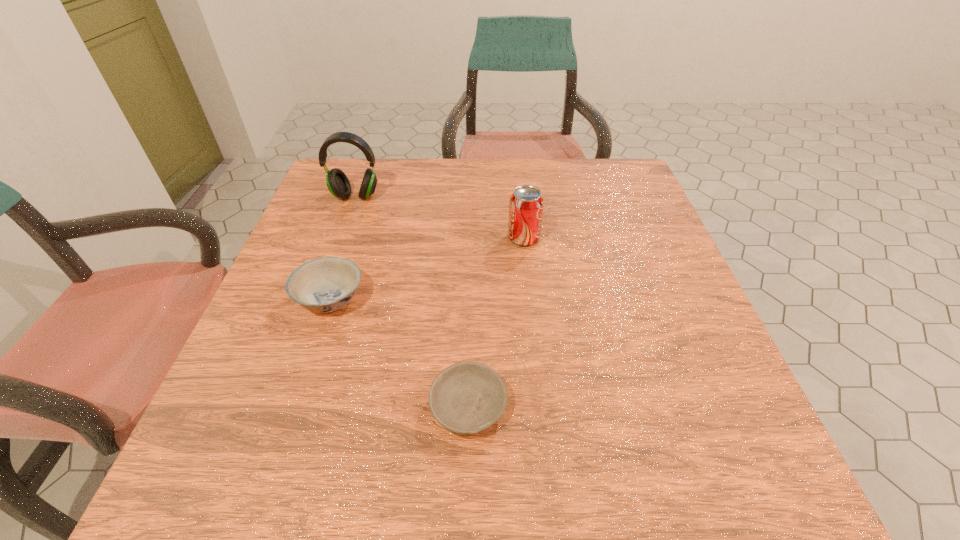
Locate an element on the screen. The width and height of the screenshot is (960, 540). free spot located 0.100m on the front of the left bowl is located at coordinates (306, 369).

This screenshot has height=540, width=960. Find the location of `free space located on the back of the second object from right to left`. free space located on the back of the second object from right to left is located at coordinates (470, 322).

Image resolution: width=960 pixels, height=540 pixels. I want to click on object that is at the far edge, so click(338, 184).

The image size is (960, 540). I want to click on object present at the near edge, so click(466, 398).

I want to click on headset at the left edge, so click(338, 184).

Locate an element on the screen. bowl at the left edge is located at coordinates (322, 285).

The width and height of the screenshot is (960, 540). In order to click on object located in the far left corner section of the desktop in this screenshot , I will do `click(338, 184)`.

Locate an element on the screen. This screenshot has width=960, height=540. vacant space at the far edge of the desktop is located at coordinates (452, 205).

Find the location of a particular element. This screenshot has height=540, width=960. free space at the near edge is located at coordinates (333, 470).

In the image, there is a desktop. Find the location of `vacant space at the left edge`. vacant space at the left edge is located at coordinates (280, 283).